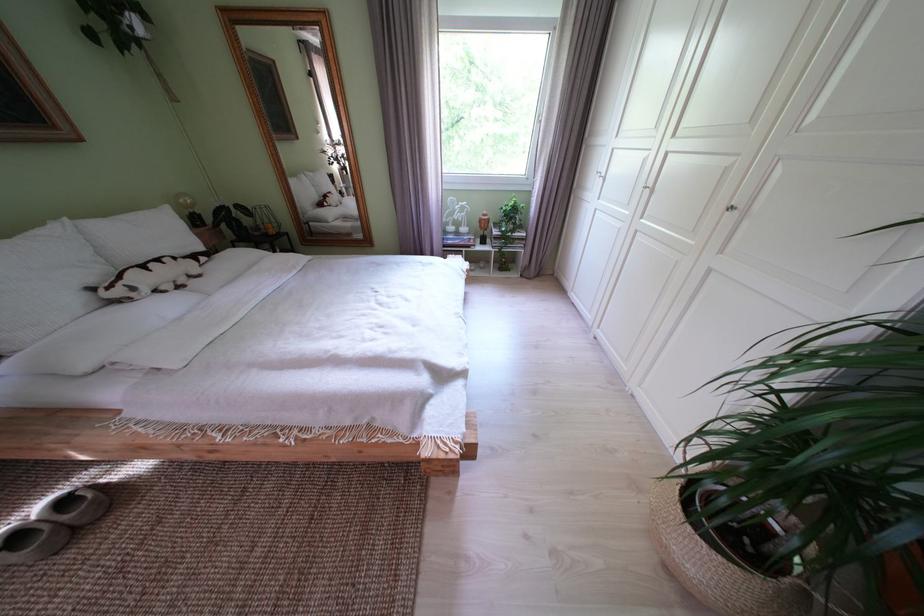
This screenshot has height=616, width=924. What do you see at coordinates (731, 208) in the screenshot?
I see `the silver cabinet knob` at bounding box center [731, 208].